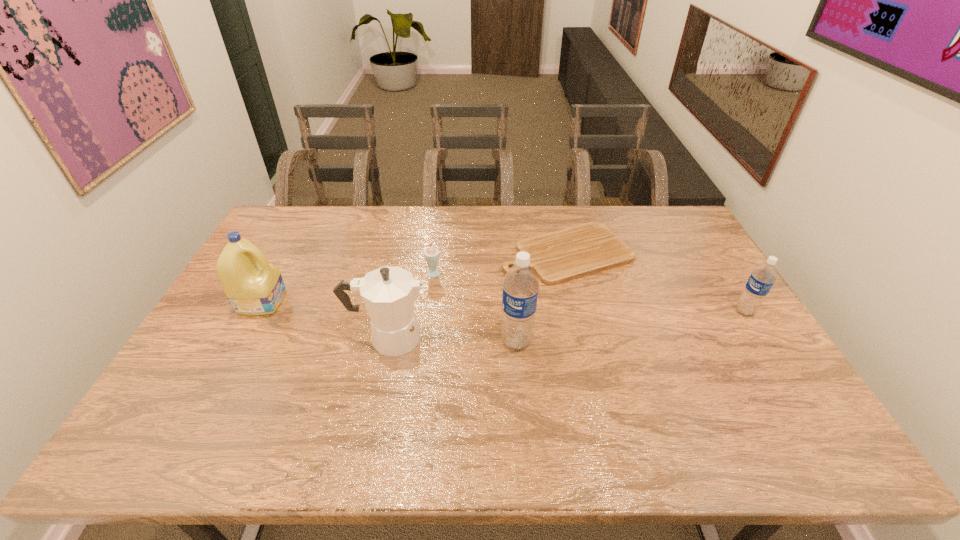
You are a GUI agent. You are given a task and a screenshot of the screen. Output one action in this format:
    pyautogui.click(x=<x>, y=<y>)
    Task: Click on the nearer water bottle
    
    Given the screenshot: What is the action you would take?
    pyautogui.click(x=520, y=286)

You are a GUI agent. You are given a task and a screenshot of the screen. Output one action in this format:
    pyautogui.click(x=<x>, y=<y>)
    Task: Click on the left water bottle
    The width and height of the screenshot is (960, 540).
    Given the screenshot: What is the action you would take?
    pyautogui.click(x=520, y=286)

I want to click on the fourth tallest object, so click(x=761, y=280).

Locate an element on the screen. The image size is (960, 540). the shorter water bottle is located at coordinates (761, 280).

In order to click on milkshake in this screenshot , I will do `click(431, 254)`.

Locate an element on the screen. This screenshot has height=540, width=960. chopping board is located at coordinates (556, 257).

Where is `coffeepot`? This screenshot has height=540, width=960. coffeepot is located at coordinates (388, 293).

At what (x,y) coordinates should I click in order to perform the action: click on detergent. Please return your answer as a coordinate pair (x, y). This screenshot has width=960, height=540. Looking at the image, I should click on (253, 286).

Identify the location of vacant region located on the back of the left water bottle. This screenshot has width=960, height=540. (510, 265).

Image resolution: width=960 pixels, height=540 pixels. I want to click on vacant space situated on the left of the shorter water bottle, so click(718, 312).